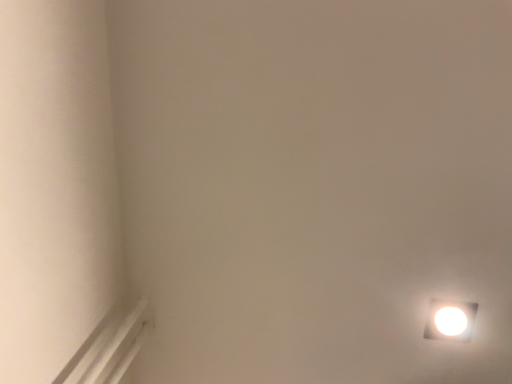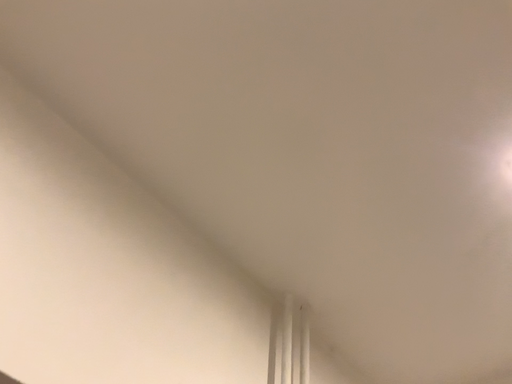
Question: Which way did the camera rotate in the video?

Choices:
 (A) rotated left
 (B) rotated right

Answer: (A)